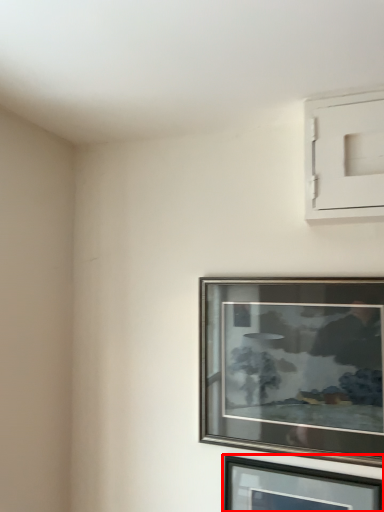
Question: From the image's perspective, considering the relative positions of picture frame (annotated by the red box) and picture frame in the image provided, where is picture frame (annotated by the red box) located with respect to the staircase?

Choices:
 (A) above
 (B) below

Answer: (B)